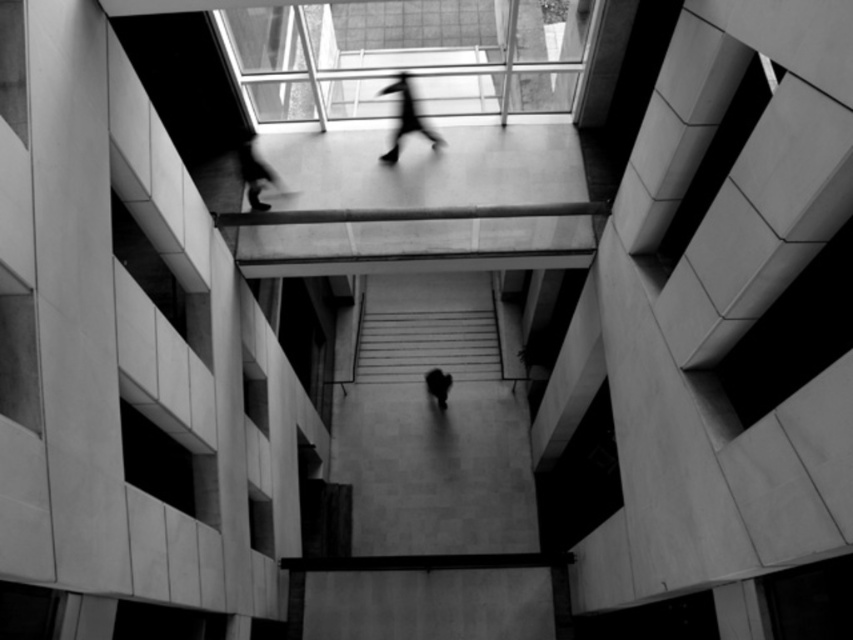
You are standing at the entrance of the atrium and see the silhouette figure at upper center and the blurred figure at upper center. Which figure is closer to the ground floor?

The silhouette figure at upper center is closer to the ground floor because it is located below the blurred figure at upper center.

You are standing at the top of the atrium looking down. You see the smooth concrete stairs at center and the dark figure at center. Which object is positioned higher in the scene?

The smooth concrete stairs at center is located above the dark figure at center, so the smooth concrete stairs at center is positioned higher in the scene.